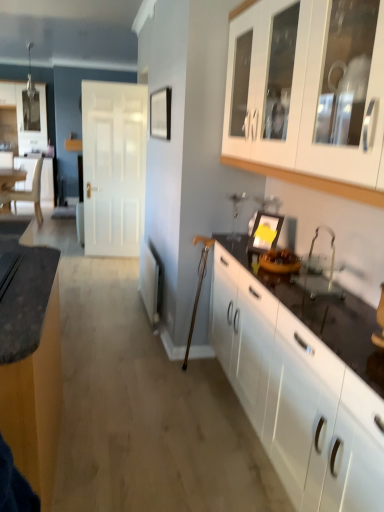
Question: From a real-world perspective, is white glossy cabinet at upper right, the first cabinetry from the right, physically above yellow paper at center?

Choices:
 (A) yes
 (B) no

Answer: (A)

Question: Can you confirm if white glossy cabinet at upper right, the first cabinetry from the right, is thinner than yellow paper at center?

Choices:
 (A) no
 (B) yes

Answer: (A)

Question: Does white glossy cabinet at upper right, the first cabinetry from the right, have a larger size compared to yellow paper at center?

Choices:
 (A) yes
 (B) no

Answer: (A)

Question: Can you confirm if white glossy cabinet at upper right, marked as the 3th cabinetry in a left-to-right arrangement, is positioned to the left of yellow paper at center?

Choices:
 (A) yes
 (B) no

Answer: (B)

Question: From a real-world perspective, is white glossy cabinet at upper right, marked as the 3th cabinetry in a left-to-right arrangement, located beneath yellow paper at center?

Choices:
 (A) yes
 (B) no

Answer: (B)

Question: Is white glossy cabinets at right, which is the 2th cabinetry from right to left, in front of or behind wooden table at left in the image?

Choices:
 (A) behind
 (B) front

Answer: (B)

Question: Would you say white glossy cabinets at right, which is the 2th cabinetry from right to left, is to the left or to the right of wooden table at left in the picture?

Choices:
 (A) left
 (B) right

Answer: (B)

Question: From a real-world perspective, is white glossy cabinets at right, which is the 2th cabinetry from right to left, physically located above or below wooden table at left?

Choices:
 (A) below
 (B) above

Answer: (A)

Question: Choose the correct answer: Is white glossy cabinets at right, which is the 2th cabinetry from right to left, inside wooden table at left or outside it?

Choices:
 (A) inside
 (B) outside

Answer: (B)

Question: From the image's perspective, relative to matte black countertop at left, which is the 3th cabinetry from right to left, is clear glass sink at lower right above or below?

Choices:
 (A) above
 (B) below

Answer: (A)

Question: Would you say clear glass sink at lower right is to the left or to the right of matte black countertop at left, which appears as the first cabinetry when viewed from the left, in the picture?

Choices:
 (A) right
 (B) left

Answer: (A)

Question: Based on their sizes in the image, would you say clear glass sink at lower right is bigger or smaller than matte black countertop at left, which appears as the first cabinetry when viewed from the left?

Choices:
 (A) small
 (B) big

Answer: (A)

Question: From their relative heights in the image, would you say clear glass sink at lower right is taller or shorter than matte black countertop at left, which is the 3th cabinetry from right to left?

Choices:
 (A) tall
 (B) short

Answer: (B)

Question: From the image's perspective, is white matte door at center positioned above or below wooden table at left?

Choices:
 (A) below
 (B) above

Answer: (A)

Question: Considering the positions of white matte door at center and wooden table at left in the image, is white matte door at center bigger or smaller than wooden table at left?

Choices:
 (A) big
 (B) small

Answer: (A)